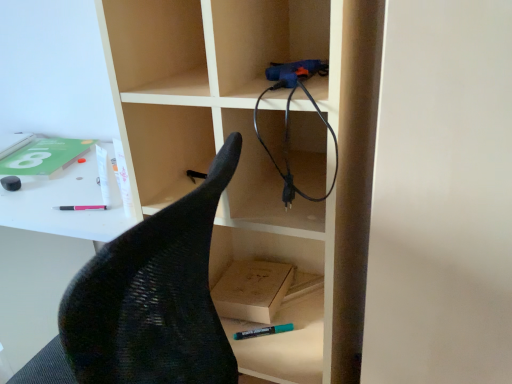
Question: Is point (184, 139) closer or farther from the camera than point (16, 177)?

Choices:
 (A) farther
 (B) closer

Answer: (B)

Question: Is wooden bookshelf at center bigger or smaller than matte black eraser at left, which ranks as the second stationery in bottom-to-top order?

Choices:
 (A) big
 (B) small

Answer: (A)

Question: Based on their relative distances, which object is nearer to the black mesh chair at left?

Choices:
 (A) matte black eraser at left, which is the second stationery in front-to-back order
 (B) teal matte marker at lower center, the second stationery from the left
 (C) light brown cardboard box at lower center
 (D) wooden bookshelf at center
 (E) black rubber cable at upper right

Answer: (D)

Question: Which object is positioned closest to the wooden bookshelf at center?

Choices:
 (A) black rubber cable at upper right
 (B) black mesh chair at left
 (C) light brown cardboard box at lower center
 (D) teal matte marker at lower center, the 2th stationery in the top-to-bottom sequence
 (E) matte black eraser at left, which is the second stationery in front-to-back order

Answer: (A)